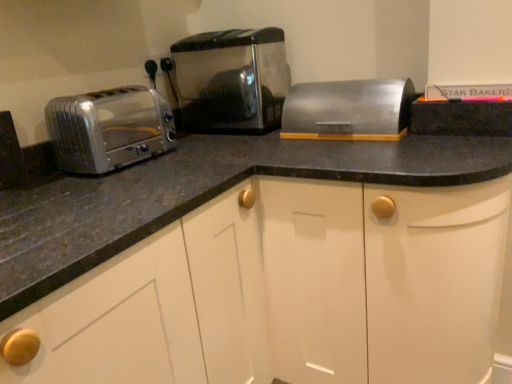
Where is `satin silver breadbox at center`? satin silver breadbox at center is located at coordinates (348, 110).

How much space does satin silver toaster at left, positioned as the second toaster in right-to-left order, occupy vertically?

The height of satin silver toaster at left, positioned as the second toaster in right-to-left order, is 8.30 inches.

What is the approximate width of satin metallic toaster at center, the second toaster viewed from the left?

satin metallic toaster at center, the second toaster viewed from the left, is 10.91 inches in width.

Where is `satin silver breadbox at center`? satin silver breadbox at center is located at coordinates (348, 110).

Which object is closer to the camera taking this photo, satin silver toaster at left, positioned as the second toaster in right-to-left order, or satin silver breadbox at center?

satin silver toaster at left, positioned as the second toaster in right-to-left order, is closer to the camera.

From the image's perspective, is satin silver toaster at left, positioned as the second toaster in right-to-left order, on top of satin silver breadbox at center?

Actually, satin silver toaster at left, positioned as the second toaster in right-to-left order, appears below satin silver breadbox at center in the image.

Would you say satin silver toaster at left, positioned as the second toaster in right-to-left order, is outside satin silver breadbox at center?

satin silver toaster at left, positioned as the second toaster in right-to-left order, is positioned outside satin silver breadbox at center.

Is satin silver toaster at left, positioned as the second toaster in right-to-left order, touching satin silver breadbox at center?

No, satin silver toaster at left, positioned as the second toaster in right-to-left order, is not touching satin silver breadbox at center.

Is satin metallic toaster at center, acting as the 1th toaster starting from the right, wider than satin silver breadbox at center?

Correct, the width of satin metallic toaster at center, acting as the 1th toaster starting from the right, exceeds that of satin silver breadbox at center.

From the image's perspective, is satin metallic toaster at center, the second toaster viewed from the left, above or below satin silver breadbox at center?

Based on their image positions, satin metallic toaster at center, the second toaster viewed from the left, is located above satin silver breadbox at center.

Does point (177, 49) appear closer or farther from the camera than point (364, 82)?

Point (177, 49).

From a real-world perspective, which is physically above, satin metallic toaster at center, the second toaster viewed from the left, or satin silver breadbox at center?

From a 3D spatial view, satin metallic toaster at center, the second toaster viewed from the left, is above.

Is satin silver toaster at left, positioned as the second toaster in right-to-left order, completely or partially outside of satin metallic toaster at center, acting as the 1th toaster starting from the right?

Yes, satin silver toaster at left, positioned as the second toaster in right-to-left order, is outside of satin metallic toaster at center, acting as the 1th toaster starting from the right.

From the picture: Considering the relative sizes of satin silver toaster at left, positioned as the second toaster in right-to-left order, and satin metallic toaster at center, acting as the 1th toaster starting from the right, in the image provided, is satin silver toaster at left, positioned as the second toaster in right-to-left order, thinner than satin metallic toaster at center, acting as the 1th toaster starting from the right,?

Indeed, satin silver toaster at left, positioned as the second toaster in right-to-left order, has a lesser width compared to satin metallic toaster at center, acting as the 1th toaster starting from the right.

Image resolution: width=512 pixels, height=384 pixels. What are the coordinates of `toaster lying on the right of satin silver toaster at left, positioned as the second toaster in right-to-left order` in the screenshot? It's located at (230, 79).

From a real-world perspective, which object rests below the other?

From a 3D spatial view, satin silver toaster at left, arranged as the 1th toaster when viewed from the left, is below.

From a real-world perspective, is satin silver breadbox at center physically below satin metallic toaster at center, the second toaster viewed from the left?

Correct, in the physical world, satin silver breadbox at center is lower than satin metallic toaster at center, the second toaster viewed from the left.

Can satin metallic toaster at center, the second toaster viewed from the left, be found inside satin silver breadbox at center?

Actually, satin metallic toaster at center, the second toaster viewed from the left, is outside satin silver breadbox at center.

Is satin silver breadbox at center turned away from satin metallic toaster at center, acting as the 1th toaster starting from the right?

No.

Which object is positioned more to the left, satin silver breadbox at center or satin metallic toaster at center, acting as the 1th toaster starting from the right?

satin metallic toaster at center, acting as the 1th toaster starting from the right.

Is satin silver toaster at left, arranged as the 1th toaster when viewed from the left, inside satin silver breadbox at center?

No.

From a real-world perspective, who is located higher, satin silver breadbox at center or satin silver toaster at left, arranged as the 1th toaster when viewed from the left?

satin silver toaster at left, arranged as the 1th toaster when viewed from the left.

Is satin silver breadbox at center oriented towards satin silver toaster at left, positioned as the second toaster in right-to-left order?

No.

How different are the orientations of satin silver breadbox at center and satin silver toaster at left, positioned as the second toaster in right-to-left order, in degrees?

88.9 degrees.

Would you say satin metallic toaster at center, acting as the 1th toaster starting from the right, contains satin silver toaster at left, arranged as the 1th toaster when viewed from the left?

No.

Which is behind, point (230, 117) or point (73, 132)?

Positioned behind is point (230, 117).

From the image's perspective, who appears lower, satin metallic toaster at center, acting as the 1th toaster starting from the right, or satin silver toaster at left, positioned as the second toaster in right-to-left order?

satin silver toaster at left, positioned as the second toaster in right-to-left order, appears lower in the image.

This screenshot has height=384, width=512. Find the location of `the 2nd toaster to the left of the satin silver breadbox at center, starting your count from the anchor`. the 2nd toaster to the left of the satin silver breadbox at center, starting your count from the anchor is located at coordinates (109, 128).

Locate an element on the screen. This screenshot has width=512, height=384. appliance below the satin metallic toaster at center, acting as the 1th toaster starting from the right (from a real-world perspective) is located at coordinates (348, 110).

Estimate the real-world distances between objects in this image. Which object is closer to satin silver toaster at left, positioned as the second toaster in right-to-left order, satin silver breadbox at center or satin metallic toaster at center, the second toaster viewed from the left?

satin metallic toaster at center, the second toaster viewed from the left, is positioned closer to the anchor satin silver toaster at left, positioned as the second toaster in right-to-left order.

From the image, which object appears to be nearer to satin silver breadbox at center, satin metallic toaster at center, acting as the 1th toaster starting from the right, or satin silver toaster at left, positioned as the second toaster in right-to-left order?

Based on the image, satin metallic toaster at center, acting as the 1th toaster starting from the right, appears to be nearer to satin silver breadbox at center.

Estimate the real-world distances between objects in this image. Which object is closer to satin silver toaster at left, positioned as the second toaster in right-to-left order, satin metallic toaster at center, the second toaster viewed from the left, or satin silver breadbox at center?

satin metallic toaster at center, the second toaster viewed from the left.

When comparing their distances from satin silver breadbox at center, does satin silver toaster at left, arranged as the 1th toaster when viewed from the left, or satin metallic toaster at center, acting as the 1th toaster starting from the right, seem further?

Among the two, satin silver toaster at left, arranged as the 1th toaster when viewed from the left, is located further to satin silver breadbox at center.

Looking at the image, which one is located closer to satin metallic toaster at center, acting as the 1th toaster starting from the right, satin silver toaster at left, positioned as the second toaster in right-to-left order, or satin silver breadbox at center?

satin silver breadbox at center is positioned closer to the anchor satin metallic toaster at center, acting as the 1th toaster starting from the right.

Looking at the image, which one is located closer to satin metallic toaster at center, acting as the 1th toaster starting from the right, satin silver breadbox at center or satin silver toaster at left, arranged as the 1th toaster when viewed from the left?

Based on the image, satin silver breadbox at center appears to be nearer to satin metallic toaster at center, acting as the 1th toaster starting from the right.

At what (x,y) coordinates should I click in order to perform the action: click on toaster located between satin silver toaster at left, positioned as the second toaster in right-to-left order, and satin silver breadbox at center in the left-right direction. Please return your answer as a coordinate pair (x, y). Looking at the image, I should click on (230, 79).